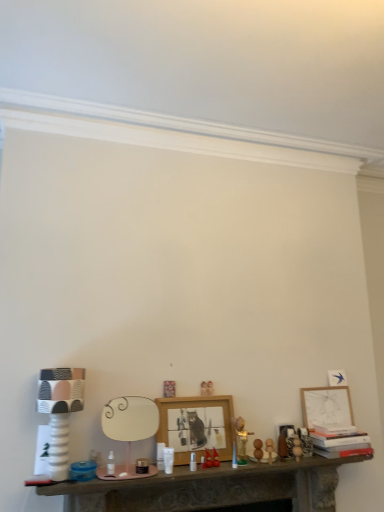
Question: Would you say matte white picture frame at right, which ranks as the 2th picture frame in left-to-right order, is outside smooth stone table at center?

Choices:
 (A) no
 (B) yes

Answer: (B)

Question: From a real-world perspective, does matte white picture frame at right, acting as the first picture frame starting from the right, sit lower than smooth stone table at center?

Choices:
 (A) yes
 (B) no

Answer: (B)

Question: Is matte white picture frame at right, acting as the first picture frame starting from the right, positioned far away from smooth stone table at center?

Choices:
 (A) no
 (B) yes

Answer: (A)

Question: From the image's perspective, does matte white picture frame at right, arranged as the 2th picture frame when viewed from the front, appear lower than smooth stone table at center?

Choices:
 (A) no
 (B) yes

Answer: (A)

Question: Does matte white picture frame at right, which ranks as the 2th picture frame in left-to-right order, have a lesser width compared to smooth stone table at center?

Choices:
 (A) yes
 (B) no

Answer: (A)

Question: Is matte white picture frame at right, acting as the first picture frame starting from the right, to the left of smooth stone table at center from the viewer's perspective?

Choices:
 (A) no
 (B) yes

Answer: (A)

Question: Can you confirm if smooth wooden eggs at center, arranged as the 2th toy when viewed from the right, is thinner than wooden ball at center, which ranks as the second toy in left-to-right order?

Choices:
 (A) no
 (B) yes

Answer: (A)

Question: Can you confirm if smooth wooden eggs at center, positioned as the first toy in left-to-right order, is wider than wooden ball at center, the 1th toy viewed from the right?

Choices:
 (A) no
 (B) yes

Answer: (B)

Question: Is smooth wooden eggs at center, positioned as the first toy in left-to-right order, behind wooden ball at center, the 1th toy viewed from the right?

Choices:
 (A) no
 (B) yes

Answer: (A)

Question: From the image's perspective, is smooth wooden eggs at center, arranged as the 2th toy when viewed from the right, located beneath wooden ball at center, the 1th toy viewed from the right?

Choices:
 (A) no
 (B) yes

Answer: (A)

Question: Is smooth wooden eggs at center, positioned as the first toy in left-to-right order, with wooden ball at center, which ranks as the second toy in left-to-right order?

Choices:
 (A) no
 (B) yes

Answer: (A)

Question: Considering the relative positions of smooth wooden eggs at center, arranged as the 2th toy when viewed from the right, and wooden ball at center, which ranks as the second toy in left-to-right order, in the image provided, is smooth wooden eggs at center, arranged as the 2th toy when viewed from the right, to the left of wooden ball at center, which ranks as the second toy in left-to-right order, from the viewer's perspective?

Choices:
 (A) no
 (B) yes

Answer: (B)

Question: Is smooth wooden eggs at center, positioned as the first toy in left-to-right order, beside matte white picture frame at right, which ranks as the 2th picture frame in left-to-right order?

Choices:
 (A) yes
 (B) no

Answer: (B)